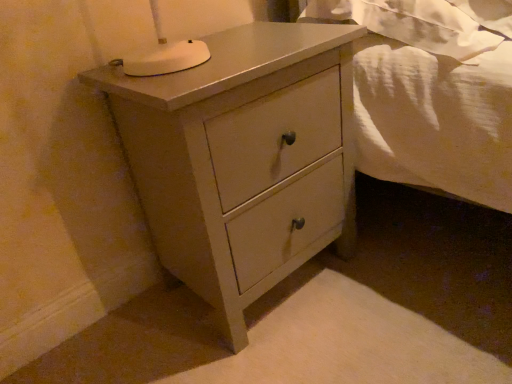
In order to click on vacant area on top of matte gray chest of drawers at center (from a real-world perspective) in this screenshot , I will do `click(227, 50)`.